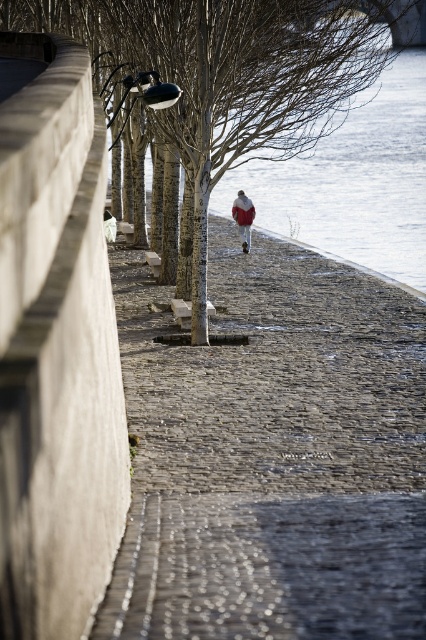
Question: Which of the following is the closest to the observer?

Choices:
 (A) gray cobblestone pavement at center
 (B) brown bark tree at center

Answer: (A)

Question: Does gray cobblestone pavement at center appear over brown bark tree at center?

Choices:
 (A) yes
 (B) no

Answer: (B)

Question: Is gray cobblestone pavement at center thinner than brown bark tree at center?

Choices:
 (A) yes
 (B) no

Answer: (A)

Question: Is gray cobblestone pavement at center wider than brown bark tree at center?

Choices:
 (A) no
 (B) yes

Answer: (A)

Question: Which point is farther to the camera?

Choices:
 (A) gray cobblestone pavement at center
 (B) brown bark tree at center

Answer: (B)